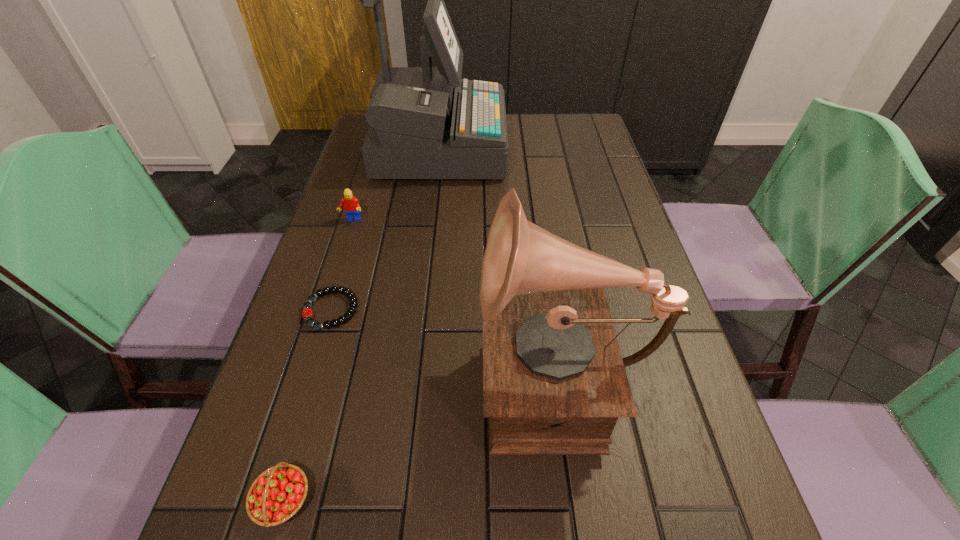
The image size is (960, 540). I want to click on unoccupied area between the bracelet and the strawberry, so click(x=307, y=405).

The width and height of the screenshot is (960, 540). I want to click on vacant area that lies between the record player and the shortest object, so [444, 341].

I want to click on free space between the shortest object and the Lego, so click(342, 265).

I want to click on object that stands as the second closest to the third tallest object, so click(307, 313).

Where is `object that is the second closest to the third tallest object`? This screenshot has height=540, width=960. object that is the second closest to the third tallest object is located at coordinates (307, 313).

You are a GUI agent. You are given a task and a screenshot of the screen. Output one action in this format:
    pyautogui.click(x=<x>, y=<y>)
    Task: Click on the free location that satisfies the following two spatial constraints: 1. on the front-facing side of the fourth tallest object; 2. on the left side of the third tallest object
    The image size is (960, 540).
    Given the screenshot: What is the action you would take?
    pyautogui.click(x=264, y=500)

Identify the location of blank space that satisfies the following two spatial constraints: 1. on the front-facing side of the third tallest object; 2. on the right side of the nearest object. This screenshot has height=540, width=960. (264, 500).

Find the location of a particular element. The image size is (960, 540). vacant space that satisfies the following two spatial constraints: 1. on the customer-facing side of the farthest object; 2. on the front side of the second shortest object is located at coordinates (393, 500).